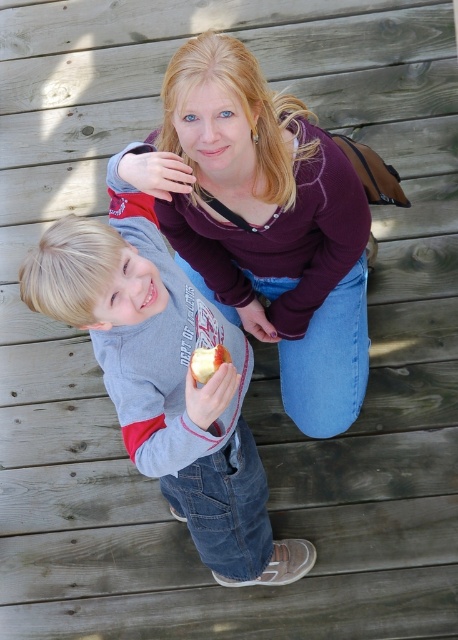
Question: Which object is positioned closest to the matte gray shirt at center?

Choices:
 (A) purple sweater at upper center
 (B) shiny red apple at center

Answer: (A)

Question: Is purple sweater at upper center bigger than shiny red apple at center?

Choices:
 (A) yes
 (B) no

Answer: (A)

Question: Among these objects, which one is nearest to the camera?

Choices:
 (A) shiny red apple at center
 (B) purple sweater at upper center
 (C) matte gray shirt at center

Answer: (C)

Question: Where is matte gray shirt at center located in relation to shiny red apple at center in the image?

Choices:
 (A) above
 (B) below

Answer: (B)

Question: Which object is farther from the camera taking this photo?

Choices:
 (A) shiny red apple at center
 (B) matte gray shirt at center
 (C) purple sweater at upper center

Answer: (A)

Question: Is purple sweater at upper center below shiny red apple at center?

Choices:
 (A) yes
 (B) no

Answer: (B)